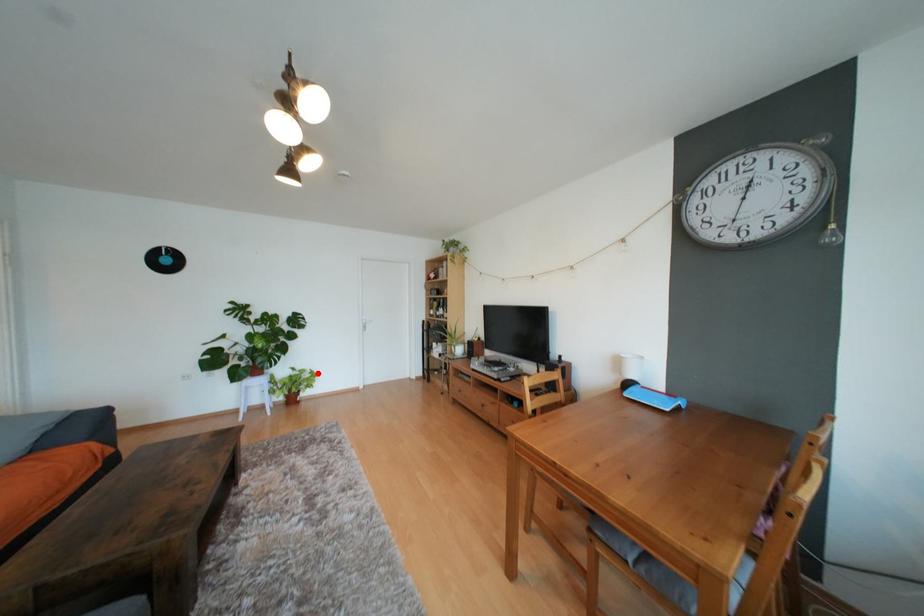
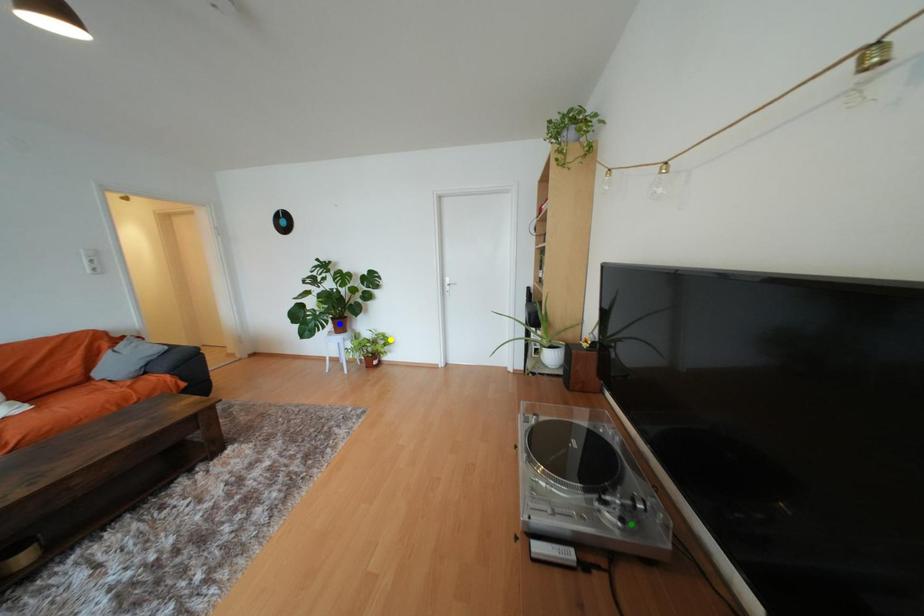
Question: I am providing you with two images of the same scene from different viewpoints. A red point is marked on the first image. You are given multiple points on the second image. Which spot in image 2 lines up with the point in image 1?

Choices:
 (A) yellow point
 (B) green point
 (C) blue point

Answer: (A)